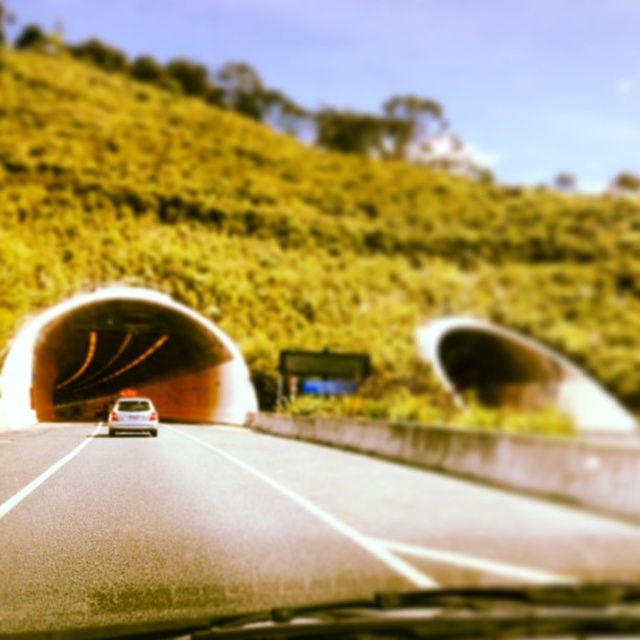
Question: Does green grassy hillside at upper center have a larger size compared to gray asphalt road at center?

Choices:
 (A) yes
 (B) no

Answer: (A)

Question: Estimate the real-world distances between objects in this image. Which object is closer to the green grassy hillside at upper center?

Choices:
 (A) gray asphalt road at center
 (B) white matte car at center

Answer: (A)

Question: Does green grassy hillside at upper center have a greater width compared to white matte car at center?

Choices:
 (A) yes
 (B) no

Answer: (A)

Question: Which object is positioned farthest from the gray asphalt road at center?

Choices:
 (A) green grassy hillside at upper center
 (B) white matte car at center

Answer: (A)

Question: Which is nearer to the white matte car at center?

Choices:
 (A) green grassy hillside at upper center
 (B) gray asphalt road at center

Answer: (B)

Question: Is gray asphalt road at center in front of white matte car at center?

Choices:
 (A) no
 (B) yes

Answer: (B)